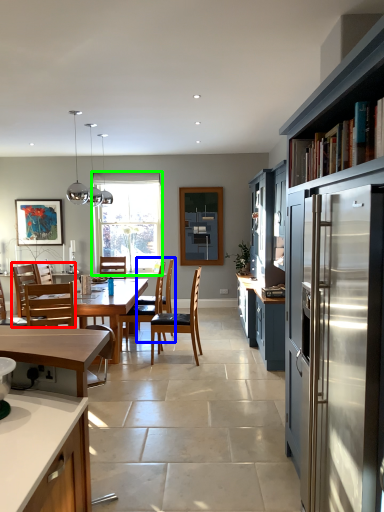
Question: Based on their relative distances, which object is nearer to chair (highlighted by a red box)? Choose from armchair (highlighted by a blue box) and window (highlighted by a green box).

Choices:
 (A) armchair
 (B) window

Answer: (A)